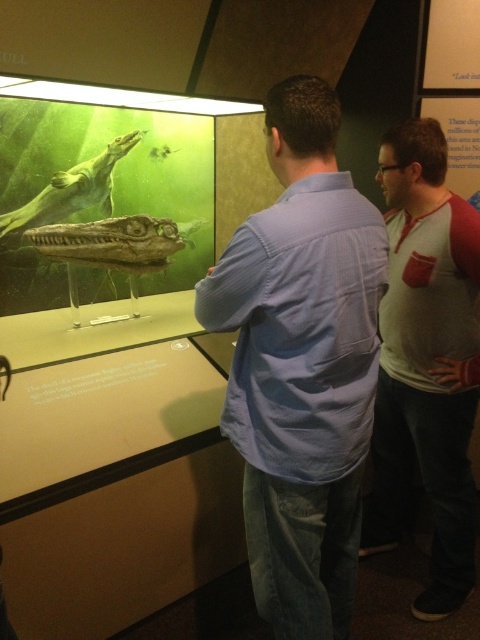
Is light blue shirt at center bigger than white/red cotton shirt at center-right?

Incorrect, light blue shirt at center is not larger than white/red cotton shirt at center-right.

Where is `light blue shirt at center`? Image resolution: width=480 pixels, height=640 pixels. light blue shirt at center is located at coordinates (301, 364).

Locate an element on the screen. This screenshot has width=480, height=640. white/red cotton shirt at center-right is located at coordinates (425, 362).

What do you see at coordinates (425, 362) in the screenshot?
I see `white/red cotton shirt at center-right` at bounding box center [425, 362].

Measure the distance between white/red cotton shirt at center-right and camera.

A distance of 5.84 feet exists between white/red cotton shirt at center-right and camera.

This screenshot has width=480, height=640. Identify the location of white/red cotton shirt at center-right. (425, 362).

Is light blue shirt at center bigger than matte green fossil at upper left?

Correct, light blue shirt at center is larger in size than matte green fossil at upper left.

Is light blue shirt at center to the right of matte green fossil at upper left from the viewer's perspective?

Indeed, light blue shirt at center is positioned on the right side of matte green fossil at upper left.

The height and width of the screenshot is (640, 480). Identify the location of light blue shirt at center. (301, 364).